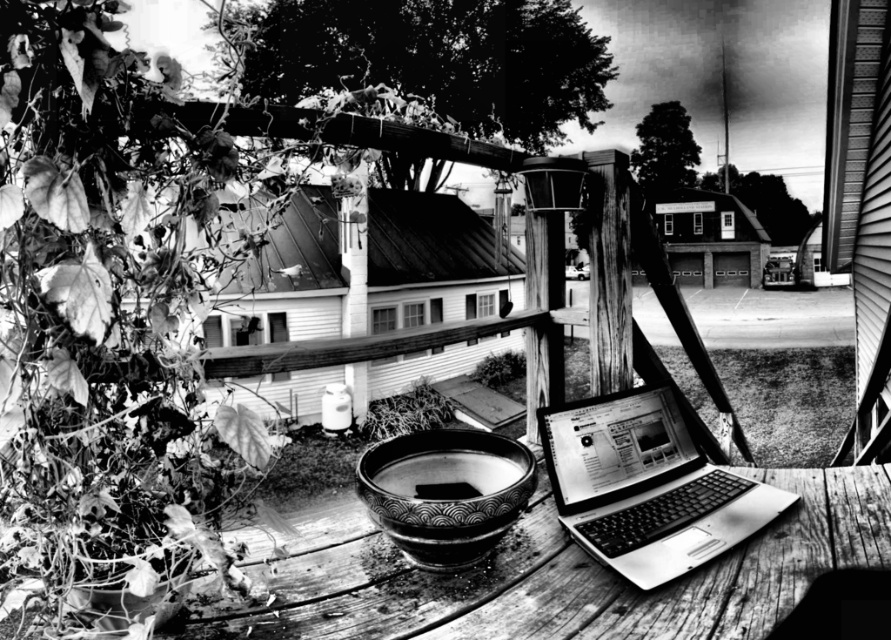
Measure the distance between point (642, 557) and camera.

They are 3.96 feet apart.

Can you confirm if metallic silver laptop at center is taller than patterned ceramic bowl at center?

Yes.

The height and width of the screenshot is (640, 891). Identify the location of metallic silver laptop at center. (646, 486).